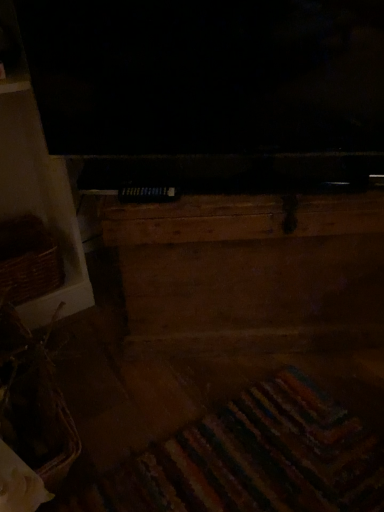
What do you see at coordinates (36, 415) in the screenshot?
I see `woven brown basket at lower left, which is the second basket from top to bottom` at bounding box center [36, 415].

Where is `brown woven basket at left, which appears as the 1th basket when viewed from the back`? brown woven basket at left, which appears as the 1th basket when viewed from the back is located at coordinates (28, 259).

Locate an element on the screen. The image size is (384, 512). wooden chest at center is located at coordinates (251, 272).

Which is in front, brown woven basket at left, the 1th basket from the top, or wooden chest at center?

wooden chest at center is closer to the camera.

Is wooden chest at center completely or partially inside brown woven basket at left, placed as the second basket when sorted from bottom to top?

No, wooden chest at center is located outside of brown woven basket at left, placed as the second basket when sorted from bottom to top.

From a real-world perspective, who is located higher, brown woven basket at left, the 1th basket from the top, or wooden chest at center?

From a 3D spatial view, wooden chest at center is above.

Considering the points (1, 229) and (225, 201), which point is in front, point (1, 229) or point (225, 201)?

The point (225, 201) is closer.

How distant is woven brown basket at lower left, which appears as the 1th basket when viewed from the front, from wooden chest at center?

woven brown basket at lower left, which appears as the 1th basket when viewed from the front, is 18.48 inches away from wooden chest at center.

Which is behind, point (37, 409) or point (138, 255)?

The point (138, 255) is farther.

Is woven brown basket at lower left, which is the second basket from top to bottom, taller than wooden chest at center?

No.

Is woven brown basket at lower left, arranged as the 1th basket when ordered from the bottom, wider or thinner than wooden chest at center?

Considering their sizes, woven brown basket at lower left, arranged as the 1th basket when ordered from the bottom, looks slimmer than wooden chest at center.

Is point (49, 437) farther from camera compared to point (10, 257)?

No, it is in front of (10, 257).

From the image's perspective, is woven brown basket at lower left, which is the second basket from top to bottom, under brown woven basket at left, which appears as the 1th basket when viewed from the back?

Correct, woven brown basket at lower left, which is the second basket from top to bottom, appears lower than brown woven basket at left, which appears as the 1th basket when viewed from the back, in the image.

Is woven brown basket at lower left, which appears as the 1th basket when viewed from the front, taller than brown woven basket at left, placed as the second basket when sorted from bottom to top?

Yes, woven brown basket at lower left, which appears as the 1th basket when viewed from the front, is taller than brown woven basket at left, placed as the second basket when sorted from bottom to top.

Do you think woven brown basket at lower left, arranged as the 1th basket when ordered from the bottom, is within brown woven basket at left, placed as the second basket when sorted from bottom to top, or outside of it?

woven brown basket at lower left, arranged as the 1th basket when ordered from the bottom, lies outside brown woven basket at left, placed as the second basket when sorted from bottom to top.

Which object is thinner, wooden chest at center or brown woven basket at left, the 1th basket from the top?

Thinner between the two is brown woven basket at left, the 1th basket from the top.

Could brown woven basket at left, the second basket positioned from the front, be considered to be inside wooden chest at center?

Definitely not — brown woven basket at left, the second basket positioned from the front, is not inside wooden chest at center.

Can you see wooden chest at center touching brown woven basket at left, placed as the second basket when sorted from bottom to top?

wooden chest at center and brown woven basket at left, placed as the second basket when sorted from bottom to top, are not in contact.

Considering their positions, is wooden chest at center located in front of or behind brown woven basket at left, which appears as the 1th basket when viewed from the back?

Visually, wooden chest at center is located in front of brown woven basket at left, which appears as the 1th basket when viewed from the back.

From the image's perspective, which is above, wooden chest at center or woven brown basket at lower left, which is the second basket from top to bottom?

From the image's view, wooden chest at center is above.

Which point is more forward, (207, 342) or (40, 352)?

The point (40, 352) is closer.

Is wooden chest at center at the right side of woven brown basket at lower left, which appears as the 1th basket when viewed from the front?

Correct, you'll find wooden chest at center to the right of woven brown basket at lower left, which appears as the 1th basket when viewed from the front.

Which of these two, brown woven basket at left, the second basket positioned from the front, or woven brown basket at lower left, arranged as the 1th basket when ordered from the bottom, is wider?

woven brown basket at lower left, arranged as the 1th basket when ordered from the bottom.

From the image's perspective, is brown woven basket at left, the 1th basket from the top, on woven brown basket at lower left, which is the second basket from top to bottom?

Correct, brown woven basket at left, the 1th basket from the top, appears higher than woven brown basket at lower left, which is the second basket from top to bottom, in the image.

Considering the relative sizes of brown woven basket at left, the 1th basket from the top, and woven brown basket at lower left, arranged as the 1th basket when ordered from the bottom, in the image provided, is brown woven basket at left, the 1th basket from the top, shorter than woven brown basket at lower left, arranged as the 1th basket when ordered from the bottom,?

Correct, brown woven basket at left, the 1th basket from the top, is not as tall as woven brown basket at lower left, arranged as the 1th basket when ordered from the bottom.

Are brown woven basket at left, the second basket positioned from the front, and woven brown basket at lower left, arranged as the 1th basket when ordered from the bottom, making contact?

brown woven basket at left, the second basket positioned from the front, and woven brown basket at lower left, arranged as the 1th basket when ordered from the bottom, are clearly separated.

I want to click on the 1st basket below when counting from the wooden chest at center (from the image's perspective), so click(x=28, y=259).

Identify the location of dresser on the right of woven brown basket at lower left, arranged as the 1th basket when ordered from the bottom. click(x=251, y=272).

Considering their positions, is brown woven basket at left, the second basket positioned from the front, positioned further to woven brown basket at lower left, which is the second basket from top to bottom, than wooden chest at center?

wooden chest at center lies further to woven brown basket at lower left, which is the second basket from top to bottom, than the other object.

Looking at the image, which one is located further to wooden chest at center, brown woven basket at left, which appears as the 1th basket when viewed from the back, or woven brown basket at lower left, which is the second basket from top to bottom?

brown woven basket at left, which appears as the 1th basket when viewed from the back, is further to wooden chest at center.

When comparing their distances from woven brown basket at lower left, placed as the 2th basket when sorted from back to front, does wooden chest at center or brown woven basket at left, the 1th basket from the top, seem closer?

Based on the image, brown woven basket at left, the 1th basket from the top, appears to be nearer to woven brown basket at lower left, placed as the 2th basket when sorted from back to front.

Which object lies further to the anchor point wooden chest at center, woven brown basket at lower left, arranged as the 1th basket when ordered from the bottom, or brown woven basket at left, the second basket positioned from the front?

brown woven basket at left, the second basket positioned from the front, lies further to wooden chest at center than the other object.

Looking at the image, which one is located further to brown woven basket at left, the 1th basket from the top, woven brown basket at lower left, placed as the 2th basket when sorted from back to front, or wooden chest at center?

wooden chest at center is further to brown woven basket at left, the 1th basket from the top.

Based on their spatial positions, is wooden chest at center or woven brown basket at lower left, placed as the 2th basket when sorted from back to front, further from brown woven basket at left, the 1th basket from the top?

wooden chest at center is positioned further to the anchor brown woven basket at left, the 1th basket from the top.

Image resolution: width=384 pixels, height=512 pixels. Find the location of `basket between brown woven basket at left, the 1th basket from the top, and wooden chest at center, in the horizontal direction`. basket between brown woven basket at left, the 1th basket from the top, and wooden chest at center, in the horizontal direction is located at coordinates (36, 415).